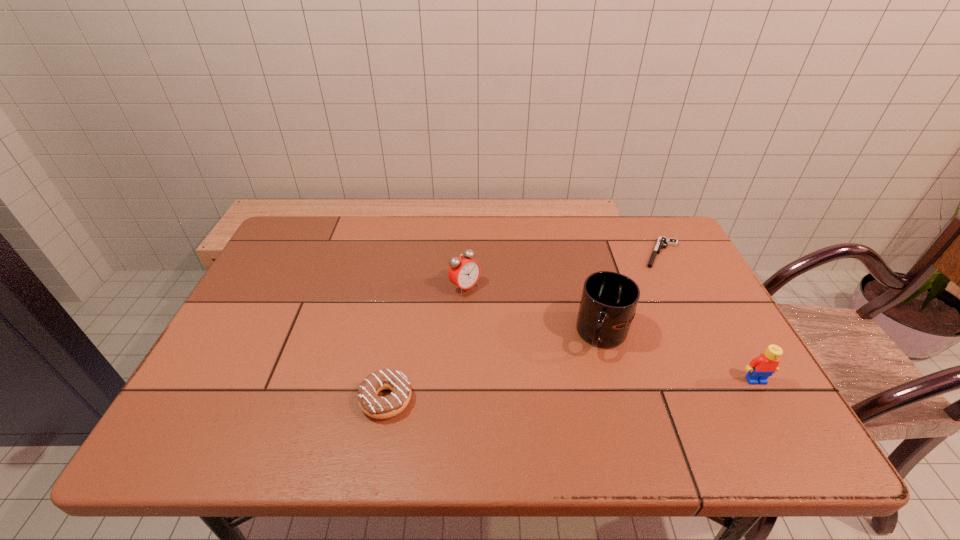
The width and height of the screenshot is (960, 540). I want to click on the third closest object to the Lego, so click(464, 272).